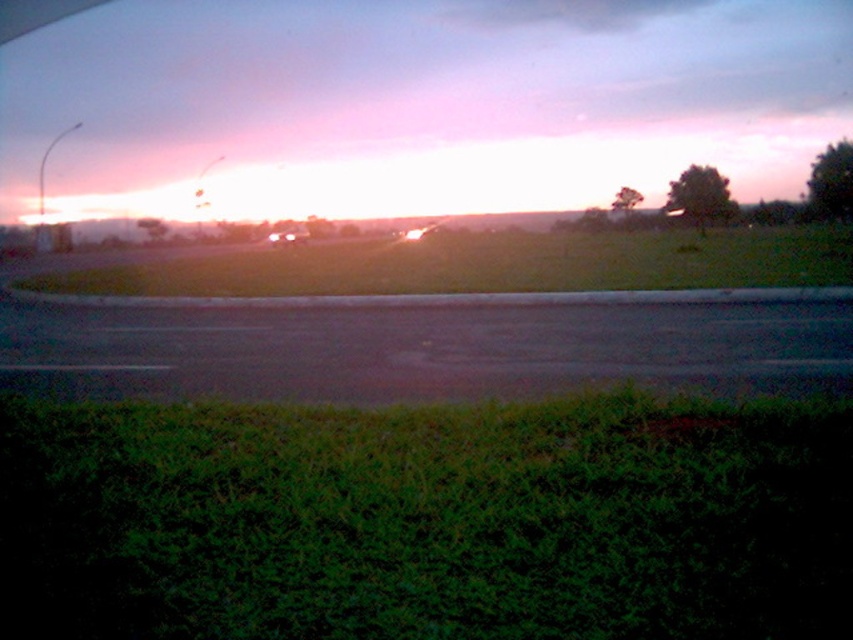
You are driving a matte black car at center and want to know if you can see the black asphalt highway at center through your rearview mirror. Based on their positions, can you see it?

The black asphalt highway at center is in front of the matte black car at center, so you cannot see it through the rearview mirror as it is behind the car.